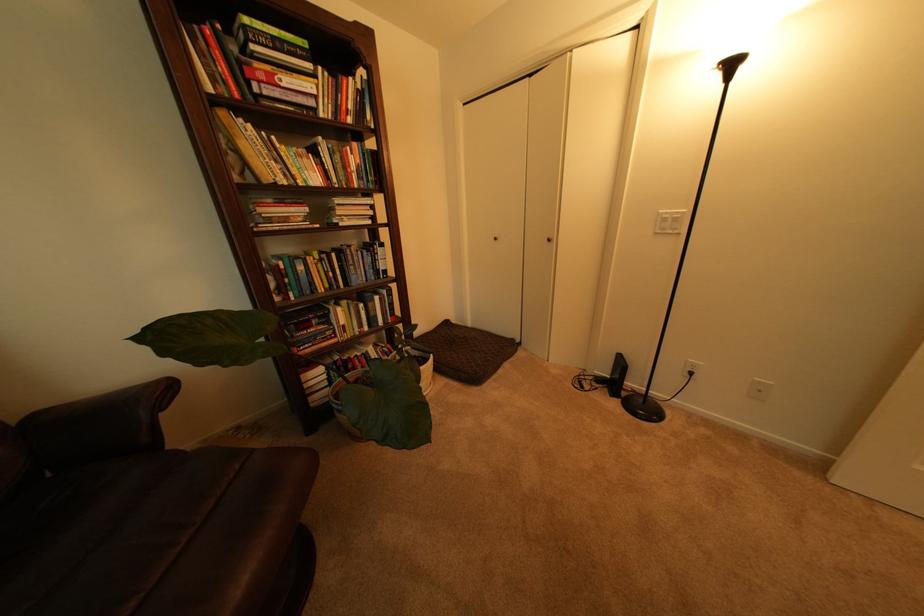
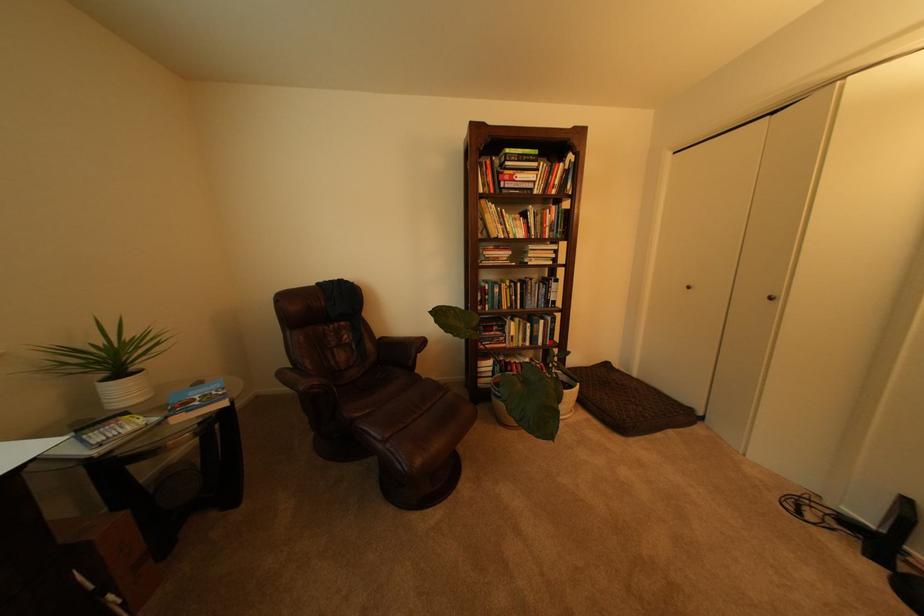
Find the pixel in the second image that matches the point at 560,241 in the first image.

(782, 300)